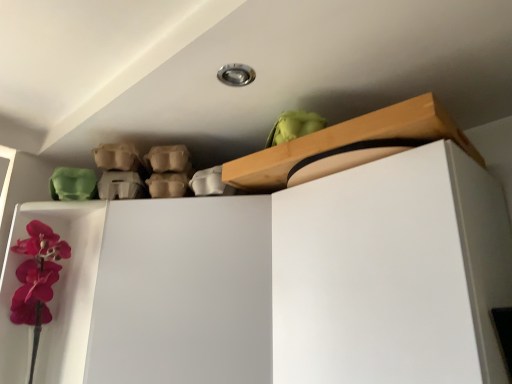
Question: In terms of height, does white matte dresser at upper center look taller or shorter compared to wooden at upper center?

Choices:
 (A) short
 (B) tall

Answer: (B)

Question: Considering the positions of point (118, 364) and point (274, 162), is point (118, 364) closer or farther from the camera than point (274, 162)?

Choices:
 (A) farther
 (B) closer

Answer: (B)

Question: Would you say white matte dresser at upper center is inside or outside wooden at upper center?

Choices:
 (A) outside
 (B) inside

Answer: (A)

Question: Is wooden at upper center taller or shorter than white matte dresser at upper center?

Choices:
 (A) tall
 (B) short

Answer: (B)

Question: Is wooden at upper center bigger or smaller than white matte dresser at upper center?

Choices:
 (A) big
 (B) small

Answer: (B)

Question: Is wooden at upper center inside or outside of white matte dresser at upper center?

Choices:
 (A) inside
 (B) outside

Answer: (B)

Question: In the image, is wooden at upper center positioned in front of or behind white matte dresser at upper center?

Choices:
 (A) behind
 (B) front

Answer: (A)